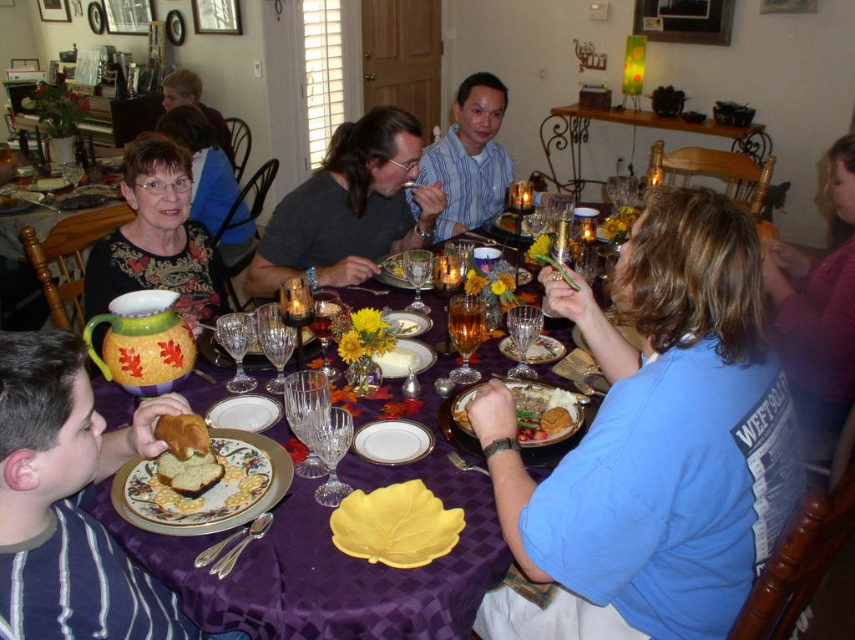
Question: In this image, where is striped fabric shirt at lower left located relative to floral-patterned blouse at left?

Choices:
 (A) above
 (B) below

Answer: (B)

Question: Which object appears closest to the camera in this image?

Choices:
 (A) blue cotton shirt at center
 (B) floral-patterned blouse at left

Answer: (A)

Question: Does striped fabric shirt at lower left appear under floral-patterned blouse at left?

Choices:
 (A) yes
 (B) no

Answer: (A)

Question: Among these points, which one is farthest from the camera?

Choices:
 (A) (27, 627)
 (B) (172, 186)

Answer: (B)

Question: Which is nearer to the floral-patterned blouse at left?

Choices:
 (A) matte blue shirt at upper left
 (B) gray cotton shirt at center
 (C) golden brown bread at center
 (D) blue striped shirt at center

Answer: (B)

Question: Does decorative ceramic plate at lower left have a greater width compared to matte blue shirt at upper left?

Choices:
 (A) no
 (B) yes

Answer: (A)